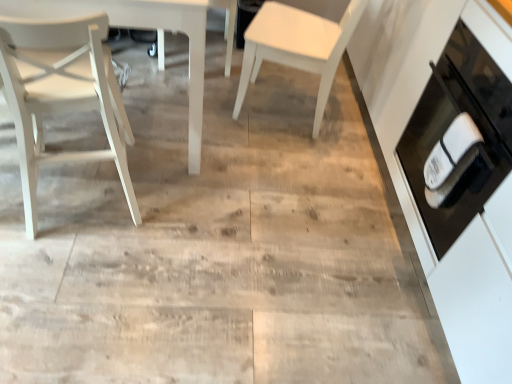
Identify the location of unoccupied region to the right of white matte chair at left, which ranks as the first chair in left-to-right order. point(195,213).